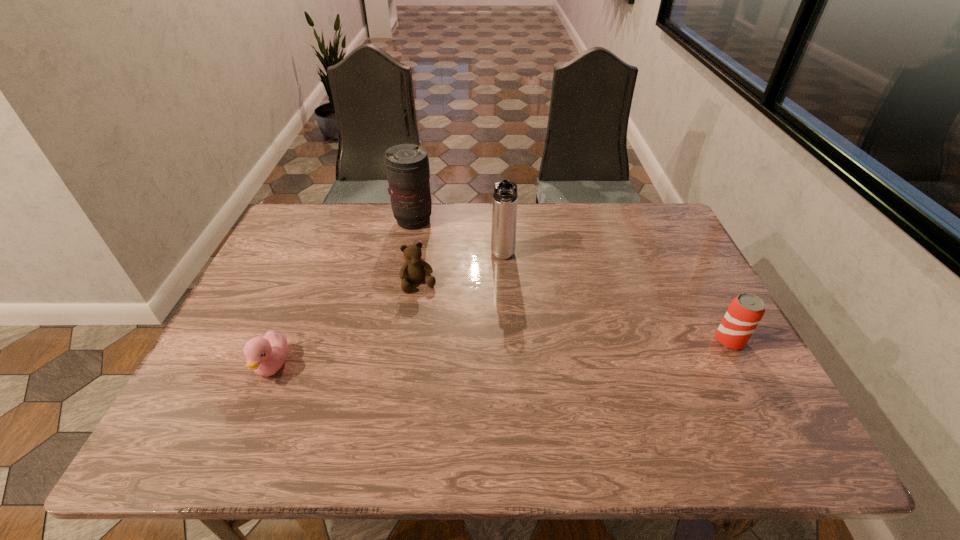
The height and width of the screenshot is (540, 960). I want to click on object that is positioned at the left edge, so click(266, 355).

I want to click on object positioned at the right edge, so click(x=746, y=310).

Where is `object at the near left corner`? object at the near left corner is located at coordinates (266, 355).

In order to click on blank space at the far edge of the desktop in this screenshot , I will do pyautogui.click(x=605, y=208).

Where is `free location at the near edge of the desktop`? free location at the near edge of the desktop is located at coordinates (360, 383).

Identify the location of vacant point at the left edge. Image resolution: width=960 pixels, height=540 pixels. (291, 278).

Where is `vacant area at the far left corner`? vacant area at the far left corner is located at coordinates (294, 215).

The image size is (960, 540). What are the coordinates of `vacant area at the far right corner of the desktop` in the screenshot? It's located at (669, 224).

Where is `vacant region between the leftmost object and the telephoto lens`? The image size is (960, 540). vacant region between the leftmost object and the telephoto lens is located at coordinates (343, 293).

This screenshot has height=540, width=960. I want to click on free area in between the telephoto lens and the rightmost object, so click(x=571, y=281).